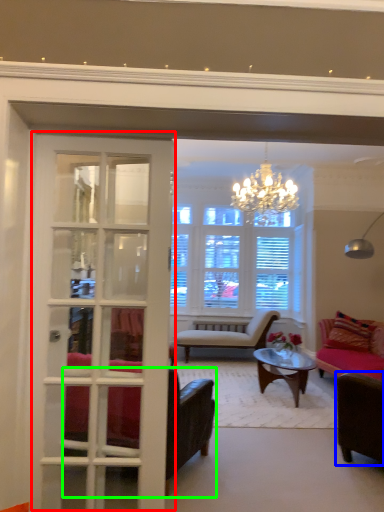
Question: Estimate the real-world distances between objects in this image. Which object is farther from door (highlighted by a red box), chair (highlighted by a blue box) or chair (highlighted by a green box)?

Choices:
 (A) chair
 (B) chair

Answer: (A)